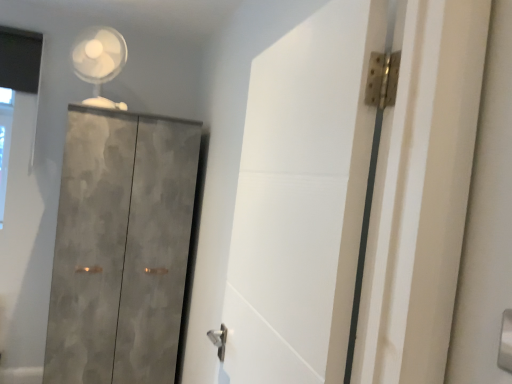
Locate an element on the screen. The width and height of the screenshot is (512, 384). textured concrete cupboard at left is located at coordinates (121, 247).

Describe the element at coordinates (99, 61) in the screenshot. The height and width of the screenshot is (384, 512). I see `white plastic fan at upper left` at that location.

Identify the location of textured concrete cupboard at left. The height and width of the screenshot is (384, 512). (121, 247).

Is textured concrete cupboard at left further to camera compared to white plastic fan at upper left?

No, textured concrete cupboard at left is closer to the camera.

Is point (79, 202) closer to camera compared to point (119, 63)?

Yes, it is in front of point (119, 63).

Based on the photo, how different are the orientations of white plastic fan at upper left and textured concrete cupboard at left in degrees?

The facing directions of white plastic fan at upper left and textured concrete cupboard at left are 22.7 degrees apart.

From the image's perspective, who appears lower, white plastic fan at upper left or textured concrete cupboard at left?

textured concrete cupboard at left appears lower in the image.

Between white plastic fan at upper left and textured concrete cupboard at left, which one has larger size?

textured concrete cupboard at left is bigger.

You are a GUI agent. You are given a task and a screenshot of the screen. Output one action in this format:
    pyautogui.click(x=<x>, y=<y>)
    Task: Click on the mechanical fan that appears behind the textured concrete cupboard at left
    Image resolution: width=512 pixels, height=384 pixels.
    Given the screenshot: What is the action you would take?
    (x=99, y=61)

From a real-world perspective, relative to textured concrete cupboard at left, is white matte door at center vertically above or below?

white matte door at center is above textured concrete cupboard at left.

Considering the sizes of objects white matte door at center and textured concrete cupboard at left in the image provided, who is shorter, white matte door at center or textured concrete cupboard at left?

With less height is white matte door at center.

From the picture: Which object is thinner, white matte door at center or textured concrete cupboard at left?

white matte door at center is thinner.

Where is `cupboard below the white matte door at center (from a real-world perspective)`? The width and height of the screenshot is (512, 384). cupboard below the white matte door at center (from a real-world perspective) is located at coordinates pyautogui.click(x=121, y=247).

Identify the location of screen door that appears on the right of white plastic fan at upper left. (301, 200).

Is white plastic fan at upper left looking in the opposite direction of white matte door at center?

white plastic fan at upper left does not have its back to white matte door at center.

Is white plastic fan at upper left situated inside white matte door at center or outside?

white plastic fan at upper left cannot be found inside white matte door at center.

Does white matte door at center have a larger size compared to white plastic fan at upper left?

Indeed, white matte door at center has a larger size compared to white plastic fan at upper left.

Is white matte door at center aimed at white plastic fan at upper left?

No, white matte door at center is not facing towards white plastic fan at upper left.

Which object is closer to the camera taking this photo, white matte door at center or white plastic fan at upper left?

white matte door at center is in front.

What's the angular difference between white matte door at center and white plastic fan at upper left's facing directions?

There is a 70-degree angle between the facing directions of white matte door at center and white plastic fan at upper left.

Are textured concrete cupboard at left and white matte door at center making contact?

No, textured concrete cupboard at left is not with white matte door at center.

Based on the photo, does textured concrete cupboard at left have a smaller size compared to white matte door at center?

Incorrect, textured concrete cupboard at left is not smaller in size than white matte door at center.

Is textured concrete cupboard at left inside or outside of white matte door at center?

textured concrete cupboard at left is located beyond the bounds of white matte door at center.

The image size is (512, 384). Identify the location of cupboard located below the white plastic fan at upper left (from the image's perspective). (121, 247).

Find the location of a particular element. The width and height of the screenshot is (512, 384). mechanical fan above the textured concrete cupboard at left (from a real-world perspective) is located at coordinates (99, 61).

Looking at this image, considering their positions, is textured concrete cupboard at left positioned closer to white matte door at center than white plastic fan at upper left?

textured concrete cupboard at left.

Looking at the image, which one is located closer to white plastic fan at upper left, white matte door at center or textured concrete cupboard at left?

Answer: Among the two, textured concrete cupboard at left is located nearer to white plastic fan at upper left.

Which object lies nearer to the anchor point white plastic fan at upper left, textured concrete cupboard at left or white matte door at center?

textured concrete cupboard at left is positioned closer to the anchor white plastic fan at upper left.

Looking at the image, which one is located closer to textured concrete cupboard at left, white matte door at center or white plastic fan at upper left?

white plastic fan at upper left is closer to textured concrete cupboard at left.

Based on their spatial positions, is white plastic fan at upper left or textured concrete cupboard at left closer to white matte door at center?

textured concrete cupboard at left is positioned closer to the anchor white matte door at center.

Based on their spatial positions, is white plastic fan at upper left or white matte door at center further from textured concrete cupboard at left?

Based on the image, white matte door at center appears to be further to textured concrete cupboard at left.

Locate an element on the screen. The image size is (512, 384). cupboard positioned between white matte door at center and white plastic fan at upper left from near to far is located at coordinates (121, 247).